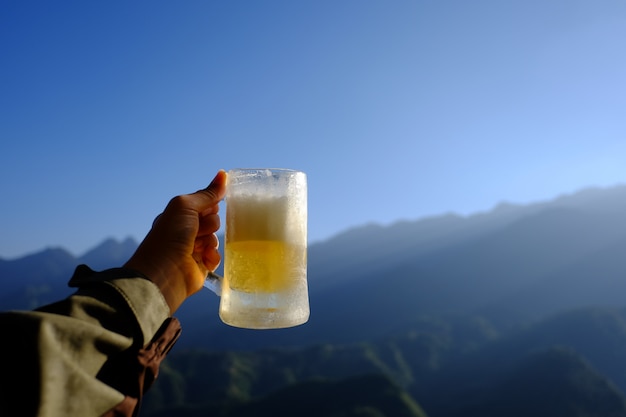
Locate an element on the screen. frosted mug is located at coordinates (299, 326).